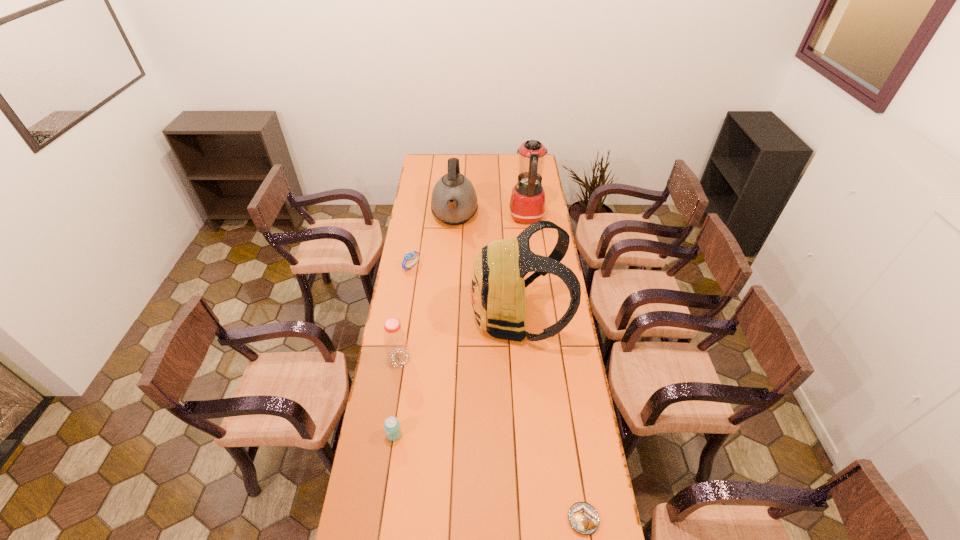
Find the location of a particular element. Image resolution: width=960 pixels, height=540 pixels. food processor is located at coordinates (527, 203).

The image size is (960, 540). What are the coordinates of `backpack` in the screenshot? It's located at (497, 284).

Identify the location of kettle. Image resolution: width=960 pixels, height=540 pixels. (454, 201).

You are a GUI agent. You are given a task and a screenshot of the screen. Output one action in this format:
    pyautogui.click(x=<x>, y=<y>)
    Task: Click on the fourth shortest object
    
    Given the screenshot: What is the action you would take?
    click(395, 339)

Where is `the second nearest object`? This screenshot has height=540, width=960. the second nearest object is located at coordinates (392, 427).

Locate an element on the screen. beer can is located at coordinates (392, 427).

Identify the location of the third farthest object. This screenshot has width=960, height=540. (408, 256).

Identify the location of the sixth tallest object. The height and width of the screenshot is (540, 960). (408, 256).

Locate an element on the screen. The image size is (960, 540). the shortest object is located at coordinates (583, 518).

This screenshot has height=540, width=960. In order to click on the nearest object in this screenshot , I will do click(x=583, y=518).